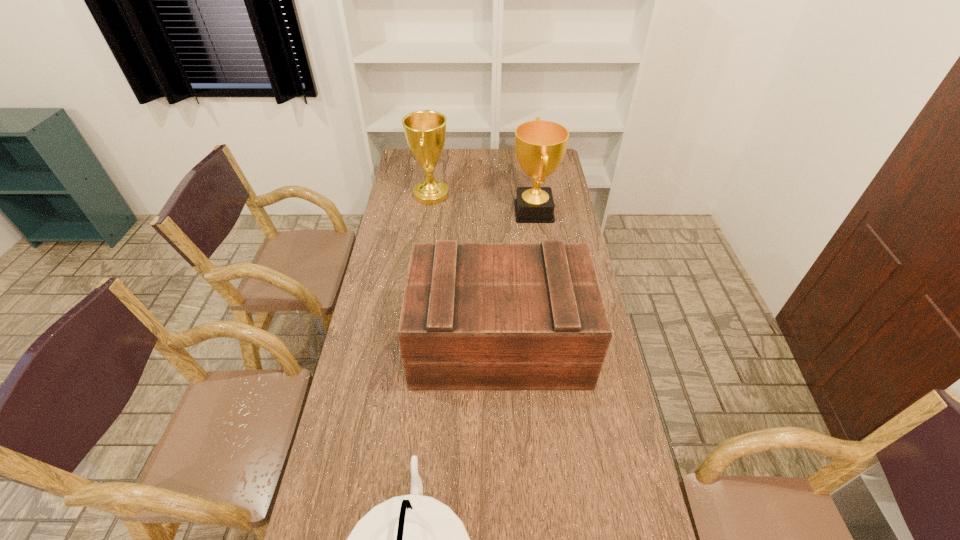
This screenshot has height=540, width=960. I want to click on box present at the right edge, so click(475, 316).

In the image, there is a desktop. Identify the location of free space at the far edge. The height and width of the screenshot is (540, 960). (494, 157).

Where is `vacant region at the left edge of the desktop`? The width and height of the screenshot is (960, 540). vacant region at the left edge of the desktop is located at coordinates (338, 476).

Identify the location of blank area at the right edge. (608, 352).

Locate an element on the screen. free space between the left award and the right award is located at coordinates (483, 203).

The width and height of the screenshot is (960, 540). What are the coordinates of `empty space between the left award and the right award` in the screenshot? It's located at (483, 203).

Point out which object is positioned as the second nearest to the third farthest object. Please provide its 2D coordinates. Your answer should be formatted as a tuple, i.e. [(x, y)], where the tuple contains the x and y coordinates of a point satisfying the conditions above.

[(540, 145)]

Select which object appears as the closest to the left award. Please provide its 2D coordinates. Your answer should be formatted as a tuple, i.e. [(x, y)], where the tuple contains the x and y coordinates of a point satisfying the conditions above.

[(540, 145)]

Identify the location of vacant position in the image that satisfies the following two spatial constraints: 1. by the handles of the box; 2. on the left side of the left award. The height and width of the screenshot is (540, 960). (x=411, y=343).

In order to click on free space that satisfies the following two spatial constraints: 1. by the handles of the left award; 2. on the back side of the third farthest object in this screenshot , I will do `click(411, 343)`.